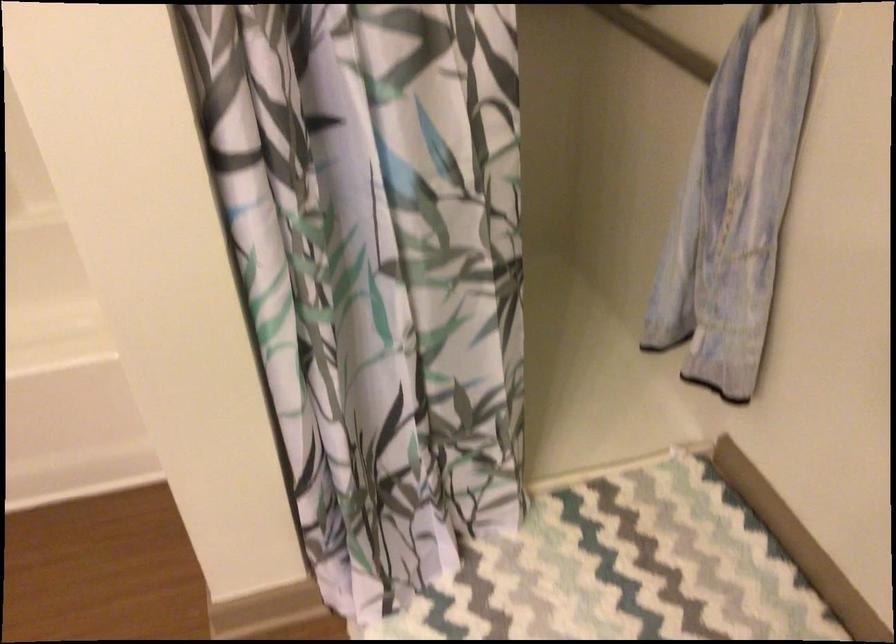
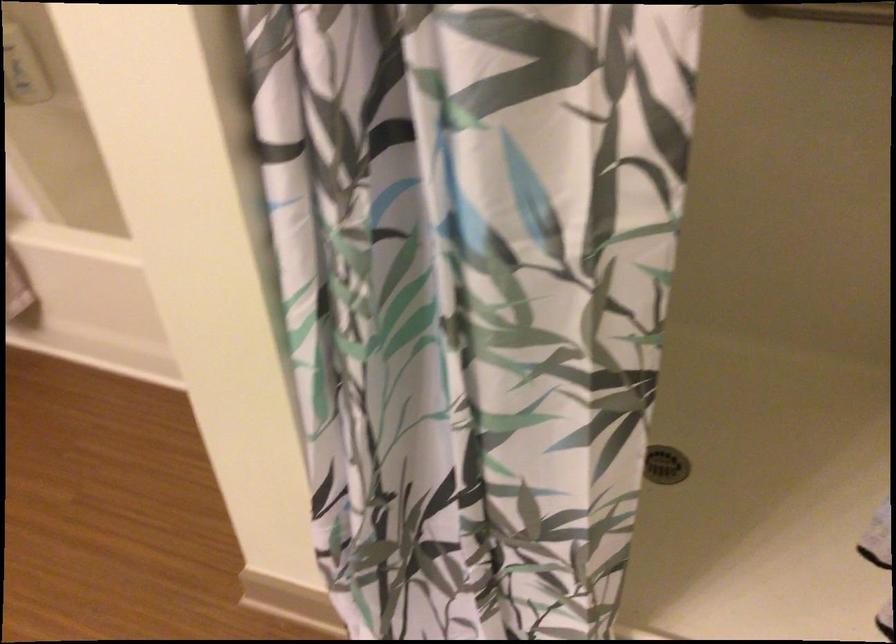
Question: How did the camera likely rotate?

Choices:
 (A) Left
 (B) Right
 (C) Up
 (D) Down

Answer: (A)